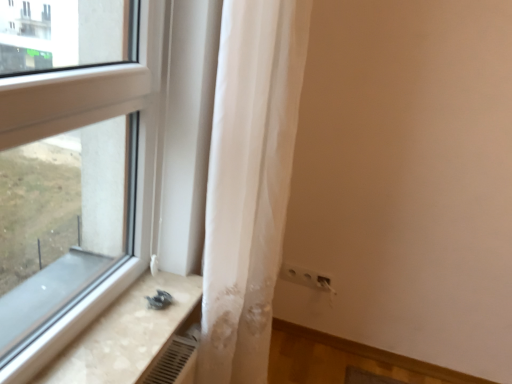
Image resolution: width=512 pixels, height=384 pixels. Describe the element at coordinates (125, 334) in the screenshot. I see `beige marble counter top at lower left` at that location.

The width and height of the screenshot is (512, 384). Find the location of `white plastic electric outlet at lower right`. white plastic electric outlet at lower right is located at coordinates (307, 277).

The width and height of the screenshot is (512, 384). In order to click on beige marble counter top at lower left in this screenshot , I will do `click(125, 334)`.

Can you confirm if white sheer curtain at center is thinner than beige marble counter top at lower left?

Correct, the width of white sheer curtain at center is less than that of beige marble counter top at lower left.

The height and width of the screenshot is (384, 512). Identify the location of counter top below the white sheer curtain at center (from a real-world perspective). (125, 334).

Could you tell me if white sheer curtain at center is facing beige marble counter top at lower left?

No, white sheer curtain at center is not facing towards beige marble counter top at lower left.

Consider the image. In terms of height, does white sheer curtain at center look taller or shorter compared to beige marble counter top at lower left?

Considering their sizes, white sheer curtain at center has more height than beige marble counter top at lower left.

Which is more to the left, white sheer curtain at center or white plastic electric outlet at lower right?

white sheer curtain at center.

Would you consider white sheer curtain at center to be distant from white plastic electric outlet at lower right?

No, white sheer curtain at center is not far from white plastic electric outlet at lower right.

Considering the relative sizes of white sheer curtain at center and white plastic electric outlet at lower right in the image provided, is white sheer curtain at center shorter than white plastic electric outlet at lower right?

Incorrect, the height of white sheer curtain at center does not fall short of that of white plastic electric outlet at lower right.

In order to click on curtain lying above the white plastic electric outlet at lower right (from the image's perspective) in this screenshot , I will do `click(249, 182)`.

Consider the image. Is beige marble counter top at lower left far from white plastic electric outlet at lower right?

No.

Which is closer, (129, 320) or (311, 284)?

The point (129, 320) is closer.

Could you measure the distance between beige marble counter top at lower left and white plastic electric outlet at lower right?

beige marble counter top at lower left is 33.29 inches from white plastic electric outlet at lower right.

From a real-world perspective, is beige marble counter top at lower left beneath white plastic electric outlet at lower right?

No.

Does point (294, 276) come in front of point (129, 298)?

That is False.

Is white plastic electric outlet at lower right placed right next to beige marble counter top at lower left?

No, white plastic electric outlet at lower right is not touching beige marble counter top at lower left.

From the image's perspective, which is above, white plastic electric outlet at lower right or beige marble counter top at lower left?

beige marble counter top at lower left, from the image's perspective.

Based on the photo, could you tell me if white plastic electric outlet at lower right is turned towards beige marble counter top at lower left?

No.

Is white plastic electric outlet at lower right smaller than white sheer curtain at center?

Yes.

Is white plastic electric outlet at lower right oriented away from white sheer curtain at center?

white plastic electric outlet at lower right does not have its back to white sheer curtain at center.

From the picture: Is white plastic electric outlet at lower right next to white sheer curtain at center?

white plastic electric outlet at lower right and white sheer curtain at center are not in contact.

Is white plastic electric outlet at lower right shorter than white sheer curtain at center?

Yes, white plastic electric outlet at lower right is shorter than white sheer curtain at center.

Measure the distance between beige marble counter top at lower left and white sheer curtain at center.

They are 12.49 inches apart.

Which object is wider, beige marble counter top at lower left or white sheer curtain at center?

beige marble counter top at lower left.

From the image's perspective, which object appears higher, beige marble counter top at lower left or white sheer curtain at center?

From the image's view, white sheer curtain at center is above.

Between point (123, 355) and point (242, 147), which one is positioned behind?

The point (242, 147) is more distant.

I want to click on counter top to the left of white sheer curtain at center, so click(125, 334).

You are a GUI agent. You are given a task and a screenshot of the screen. Output one action in this format:
    pyautogui.click(x=<x>, y=<y>)
    Task: Click on the electric outlet below the white sheer curtain at center (from a real-world perspective)
    Image resolution: width=512 pixels, height=384 pixels.
    Given the screenshot: What is the action you would take?
    pyautogui.click(x=307, y=277)

When comparing their distances from beige marble counter top at lower left, does white plastic electric outlet at lower right or white sheer curtain at center seem closer?

white sheer curtain at center lies closer to beige marble counter top at lower left than the other object.

Based on their spatial positions, is white sheer curtain at center or white plastic electric outlet at lower right further from beige marble counter top at lower left?

white plastic electric outlet at lower right is further to beige marble counter top at lower left.

Estimate the real-world distances between objects in this image. Which object is further from white sheer curtain at center, beige marble counter top at lower left or white plastic electric outlet at lower right?

Based on the image, white plastic electric outlet at lower right appears to be further to white sheer curtain at center.

From the image, which object appears to be farther from white sheer curtain at center, white plastic electric outlet at lower right or beige marble counter top at lower left?

Among the two, white plastic electric outlet at lower right is located further to white sheer curtain at center.

Looking at the image, which one is located further to white plastic electric outlet at lower right, white sheer curtain at center or beige marble counter top at lower left?

beige marble counter top at lower left is positioned further to the anchor white plastic electric outlet at lower right.

Considering their positions, is beige marble counter top at lower left positioned further to white plastic electric outlet at lower right than white sheer curtain at center?

Among the two, beige marble counter top at lower left is located further to white plastic electric outlet at lower right.

Where is `counter top between white sheer curtain at center and white plastic electric outlet at lower right in the front-back direction`? counter top between white sheer curtain at center and white plastic electric outlet at lower right in the front-back direction is located at coordinates (125, 334).